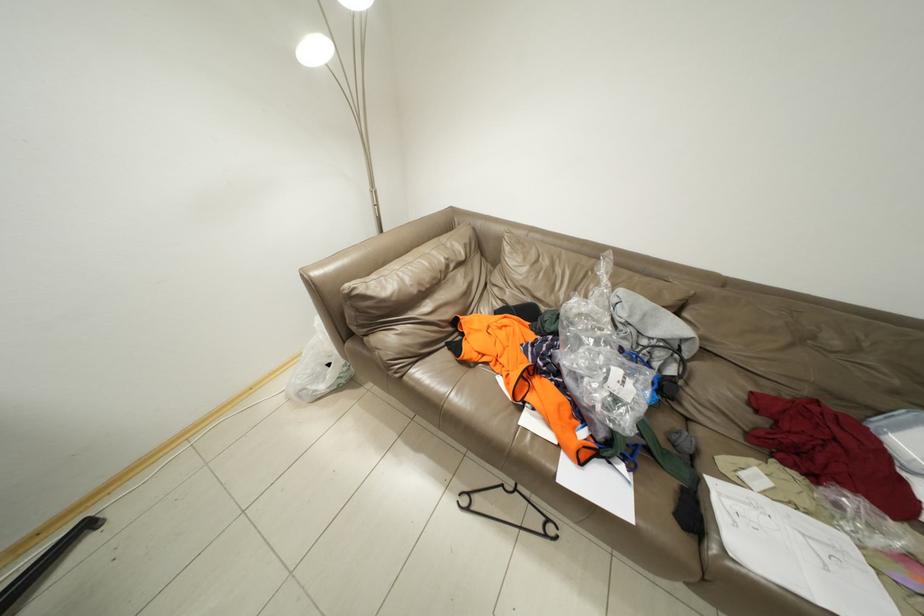
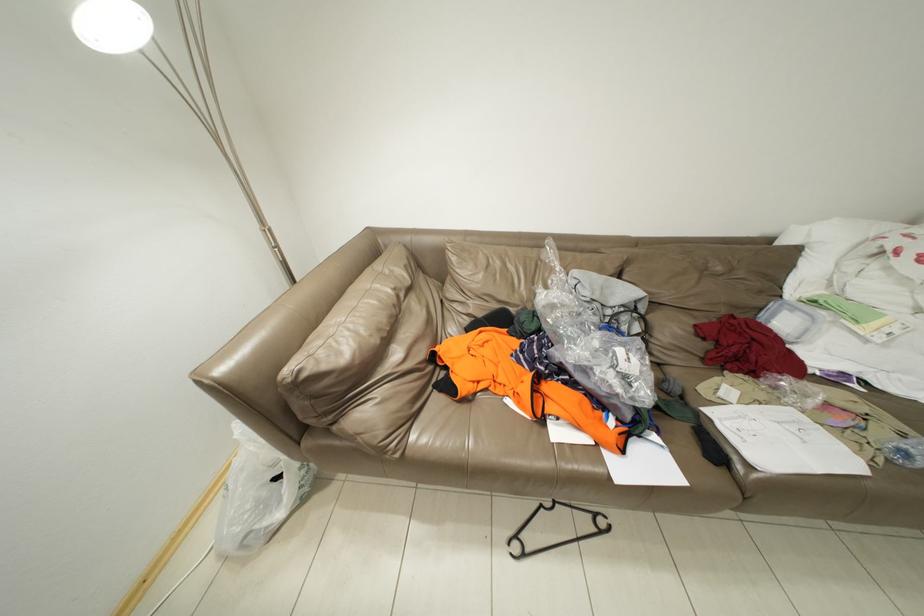
Question: How did the camera likely rotate?

Choices:
 (A) Left
 (B) Right
 (C) Up
 (D) Down

Answer: (B)